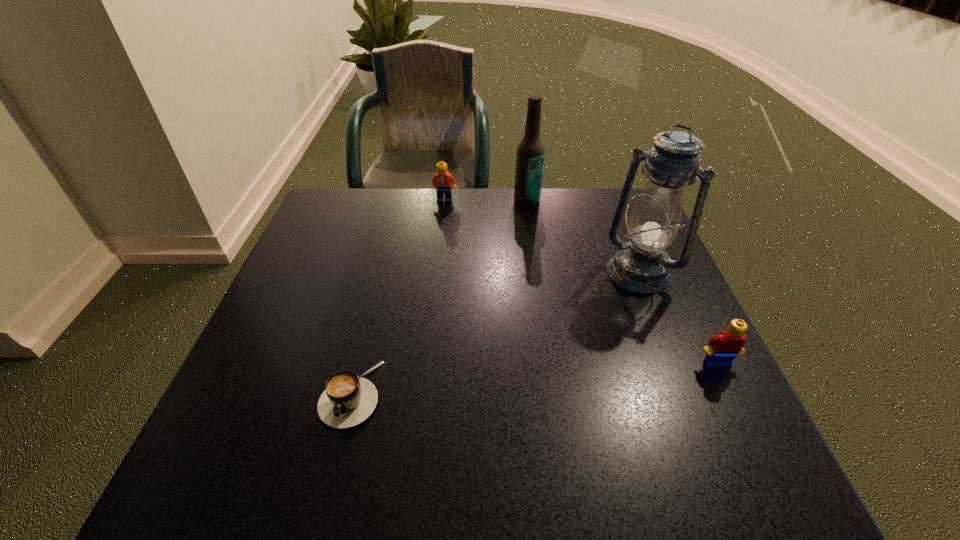
You are a GUI agent. You are given a task and a screenshot of the screen. Output one action in this format:
    pyautogui.click(x=<x>, y=<y>)
    Task: Click on the beer bottle located in the far edge section of the desktop
    This screenshot has width=960, height=540.
    Given the screenshot: What is the action you would take?
    pyautogui.click(x=530, y=155)

You are a GUI agent. You are given a task and a screenshot of the screen. Output one action in this format:
    pyautogui.click(x=<x>, y=<y>)
    Task: Click on the object that is positioned at the near edge
    The width and height of the screenshot is (960, 540).
    Given the screenshot: What is the action you would take?
    pyautogui.click(x=348, y=400)

Where is `Lego that is at the right edge`? The height and width of the screenshot is (540, 960). Lego that is at the right edge is located at coordinates (722, 349).

You are a GUI agent. You are given a task and a screenshot of the screen. Output one action in this format:
    pyautogui.click(x=<x>, y=<y>)
    Task: Click on the lantern that is at the right edge
    The height and width of the screenshot is (540, 960).
    Given the screenshot: What is the action you would take?
    pyautogui.click(x=641, y=265)

Image resolution: width=960 pixels, height=540 pixels. Find the location of `free location at the far edge`. free location at the far edge is located at coordinates (449, 232).

In the image, there is a desktop. In order to click on vacant space at the near edge in this screenshot , I will do `click(439, 395)`.

Identify the location of vacant space at the right edge of the desktop. The width and height of the screenshot is (960, 540). (671, 275).

What are the coordinates of `blank space at the far left corner` in the screenshot? It's located at (338, 203).

This screenshot has height=540, width=960. Find the location of `free location at the near left corner of the desktop`. free location at the near left corner of the desktop is located at coordinates (272, 418).

Locate an element on the screen. This screenshot has height=540, width=960. vacant space at the far right corner of the desktop is located at coordinates pos(595,187).